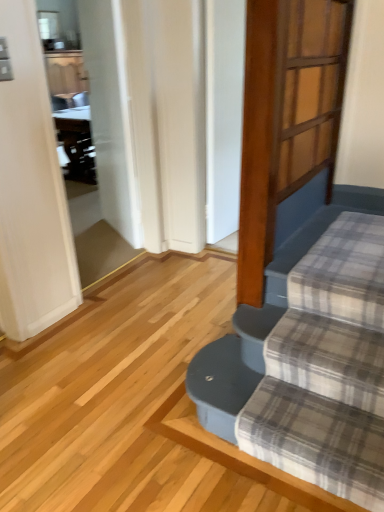
Identify the location of white glossy screen door at upper left, the 2th screen door in the front-to-back sequence. (90, 134).

In order to face wooden screen door at upper right, which is counted as the 2th screen door, starting from the back, should I rotate leftwards or rightwards?

Turn right approximately 15.468 degrees to face it.

Find the location of a particular element. white glossy screen door at upper left, the 2th screen door in the right-to-left sequence is located at coordinates (90, 134).

Which of these two, wooden screen door at upper right, which is counted as the 2th screen door, starting from the back, or plaid fabric at lower right, is wider?

plaid fabric at lower right is wider.

Who is taller, wooden screen door at upper right, the 1th screen door when ordered from right to left, or plaid fabric at lower right?

Standing taller between the two is wooden screen door at upper right, the 1th screen door when ordered from right to left.

Where is `stairwell located in front of the wooden screen door at upper right, the first screen door positioned from the front`? The width and height of the screenshot is (384, 512). stairwell located in front of the wooden screen door at upper right, the first screen door positioned from the front is located at coordinates (259, 325).

Is wooden screen door at upper right, acting as the 2th screen door starting from the left, located outside plaid fabric at lower right?

Absolutely, wooden screen door at upper right, acting as the 2th screen door starting from the left, is external to plaid fabric at lower right.

Which is more to the left, plaid fabric at lower right or white glossy screen door at upper left, the 2th screen door in the right-to-left sequence?

white glossy screen door at upper left, the 2th screen door in the right-to-left sequence, is more to the left.

Considering the sizes of objects plaid fabric at lower right and white glossy screen door at upper left, placed as the 1th screen door when sorted from left to right, in the image provided, who is smaller, plaid fabric at lower right or white glossy screen door at upper left, placed as the 1th screen door when sorted from left to right,?

plaid fabric at lower right.

Is plaid fabric at lower right taller than white glossy screen door at upper left, placed as the 1th screen door when sorted from left to right?

In fact, plaid fabric at lower right may be shorter than white glossy screen door at upper left, placed as the 1th screen door when sorted from left to right.

From the picture: Is plaid fabric at lower right far from white glossy screen door at upper left, the 2th screen door in the right-to-left sequence?

Yes, plaid fabric at lower right and white glossy screen door at upper left, the 2th screen door in the right-to-left sequence, are located far from each other.

Can you confirm if wooden screen door at upper right, the first screen door positioned from the front, is wider than white glossy screen door at upper left, placed as the 1th screen door when sorted from left to right?

In fact, wooden screen door at upper right, the first screen door positioned from the front, might be narrower than white glossy screen door at upper left, placed as the 1th screen door when sorted from left to right.

Is white glossy screen door at upper left, placed as the 1th screen door when sorted from left to right, a part of wooden screen door at upper right, which is counted as the 2th screen door, starting from the back?

No, white glossy screen door at upper left, placed as the 1th screen door when sorted from left to right, is located outside of wooden screen door at upper right, which is counted as the 2th screen door, starting from the back.

From a real-world perspective, which object stands above the other?

wooden screen door at upper right, the 1th screen door when ordered from right to left.

In the scene shown: Is white glossy screen door at upper left, the 2th screen door in the front-to-back sequence, positioned in front of wooden screen door at upper right, the first screen door positioned from the front?

No, white glossy screen door at upper left, the 2th screen door in the front-to-back sequence, is further to the viewer.

Which is more distant, (103, 103) or (296, 77)?

The point (103, 103) is behind.

From a real-world perspective, which is physically above, plaid fabric at lower right or wooden screen door at upper right, the 1th screen door when ordered from right to left?

In real-world perspective, wooden screen door at upper right, the 1th screen door when ordered from right to left, is above.

Considering the relative sizes of plaid fabric at lower right and wooden screen door at upper right, the first screen door positioned from the front, in the image provided, is plaid fabric at lower right thinner than wooden screen door at upper right, the first screen door positioned from the front,?

No.

Which object is positioned more to the right, plaid fabric at lower right or wooden screen door at upper right, the 1th screen door when ordered from right to left?

wooden screen door at upper right, the 1th screen door when ordered from right to left.

Looking at the image, does white glossy screen door at upper left, placed as the 1th screen door when sorted from left to right, seem bigger or smaller compared to plaid fabric at lower right?

white glossy screen door at upper left, placed as the 1th screen door when sorted from left to right, is bigger than plaid fabric at lower right.

From the image's perspective, which object appears higher, white glossy screen door at upper left, the 2th screen door in the right-to-left sequence, or plaid fabric at lower right?

white glossy screen door at upper left, the 2th screen door in the right-to-left sequence.

The width and height of the screenshot is (384, 512). Identify the location of stairwell lying in front of the white glossy screen door at upper left, the 2th screen door in the right-to-left sequence. (259, 325).

Are white glossy screen door at upper left, placed as the 1th screen door when sorted from left to right, and plaid fabric at lower right beside each other?

They are not placed beside each other.

Where is `screen door that appears on the right of plaid fabric at lower right`? The width and height of the screenshot is (384, 512). screen door that appears on the right of plaid fabric at lower right is located at coordinates (307, 97).

I want to click on the 2nd screen door above the plaid fabric at lower right (from the image's perspective), so click(x=90, y=134).

Estimate the real-world distances between objects in this image. Which object is further from plaid fabric at lower right, white glossy screen door at upper left, placed as the 1th screen door when sorted from left to right, or wooden screen door at upper right, acting as the 2th screen door starting from the left?

white glossy screen door at upper left, placed as the 1th screen door when sorted from left to right, is positioned further to the anchor plaid fabric at lower right.

In the scene shown: When comparing their distances from plaid fabric at lower right, does wooden screen door at upper right, the first screen door positioned from the front, or white glossy screen door at upper left, which is the first screen door from back to front, seem closer?

wooden screen door at upper right, the first screen door positioned from the front, lies closer to plaid fabric at lower right than the other object.

From the image, which object appears to be nearer to white glossy screen door at upper left, the 2th screen door in the front-to-back sequence, plaid fabric at lower right or wooden screen door at upper right, the 1th screen door when ordered from right to left?

wooden screen door at upper right, the 1th screen door when ordered from right to left, is closer to white glossy screen door at upper left, the 2th screen door in the front-to-back sequence.

Looking at the image, which one is located further to white glossy screen door at upper left, which is the first screen door from back to front, wooden screen door at upper right, the first screen door positioned from the front, or plaid fabric at lower right?

plaid fabric at lower right is positioned further to the anchor white glossy screen door at upper left, which is the first screen door from back to front.

Which object lies nearer to the anchor point wooden screen door at upper right, which is counted as the 2th screen door, starting from the back, white glossy screen door at upper left, the 2th screen door in the front-to-back sequence, or plaid fabric at lower right?

Based on the image, plaid fabric at lower right appears to be nearer to wooden screen door at upper right, which is counted as the 2th screen door, starting from the back.

When comparing their distances from wooden screen door at upper right, the first screen door positioned from the front, does plaid fabric at lower right or white glossy screen door at upper left, the 2th screen door in the front-to-back sequence, seem further?

white glossy screen door at upper left, the 2th screen door in the front-to-back sequence, is positioned further to the anchor wooden screen door at upper right, the first screen door positioned from the front.

This screenshot has width=384, height=512. Find the location of `screen door between white glossy screen door at upper left, the 2th screen door in the right-to-left sequence, and plaid fabric at lower right vertically`. screen door between white glossy screen door at upper left, the 2th screen door in the right-to-left sequence, and plaid fabric at lower right vertically is located at coordinates (307, 97).